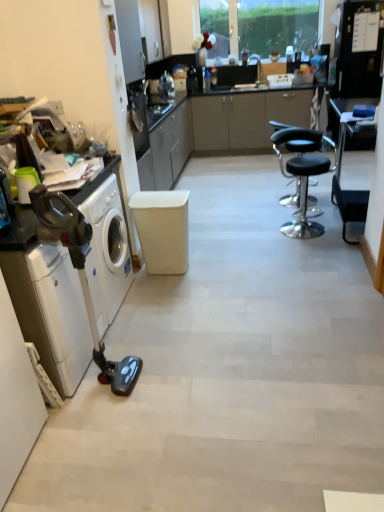
Find the location of `black leather stool at center`. black leather stool at center is located at coordinates (305, 197).

Locate an element on the screen. The height and width of the screenshot is (512, 384). white matte stool at center is located at coordinates (162, 229).

Find the location of `metallic gray vacuum cleaner at left`. metallic gray vacuum cleaner at left is located at coordinates click(74, 281).

What do you see at coordinates (350, 126) in the screenshot? Image resolution: width=384 pixels, height=512 pixels. I see `black plastic table at right` at bounding box center [350, 126].

Find the location of a particular element. This screenshot has width=384, height=512. black leather stool at center is located at coordinates click(305, 197).

Is metallic gray vacuum cleaner at left facing away from white glossy washing machine at left, which is counted as the first washing machine, starting from the back?

That's right, metallic gray vacuum cleaner at left is facing away from white glossy washing machine at left, which is counted as the first washing machine, starting from the back.

Considering the sizes of metallic gray vacuum cleaner at left and white glossy washing machine at left, which is counted as the first washing machine, starting from the back, in the image, is metallic gray vacuum cleaner at left wider or thinner than white glossy washing machine at left, which is counted as the first washing machine, starting from the back,?

Result: Clearly, metallic gray vacuum cleaner at left has more width compared to white glossy washing machine at left, which is counted as the first washing machine, starting from the back.

Considering the positions of objects metallic gray vacuum cleaner at left and white glossy washing machine at left, marked as the second washing machine in a front-to-back arrangement, in the image provided, who is more to the left, metallic gray vacuum cleaner at left or white glossy washing machine at left, marked as the second washing machine in a front-to-back arrangement,?

metallic gray vacuum cleaner at left is more to the left.

Between metallic gray vacuum cleaner at left and white glossy washing machine at left, marked as the second washing machine in a front-to-back arrangement, which one has smaller size?

Smaller between the two is white glossy washing machine at left, marked as the second washing machine in a front-to-back arrangement.

Is metallic gray vacuum cleaner at left positioned far away from black plastic table at right?

That's right, there is a large distance between metallic gray vacuum cleaner at left and black plastic table at right.

Locate an element on the screen. Image resolution: width=384 pixels, height=512 pixels. home appliance on the left of the black plastic table at right is located at coordinates (74, 281).

Which object is further away from the camera taking this photo, metallic gray vacuum cleaner at left or black plastic table at right?

black plastic table at right.

Considering the sizes of metallic gray vacuum cleaner at left and black plastic table at right in the image, is metallic gray vacuum cleaner at left taller or shorter than black plastic table at right?

Considering their sizes, metallic gray vacuum cleaner at left has less height than black plastic table at right.

Could you tell me if white plastic washing machine at left, the 2th washing machine in the back-to-front sequence, is facing black leather stool at center?

No.

Between point (74, 318) and point (300, 146), which one is positioned in front?

The point (74, 318) is more forward.

From the image's perspective, which one is positioned higher, white plastic washing machine at left, the first washing machine from the front, or black leather stool at center?

black leather stool at center appears higher in the image.

Is the position of white plastic washing machine at left, the 2th washing machine in the back-to-front sequence, more distant than that of black leather stool at center?

No, it is in front of black leather stool at center.

Is point (99, 307) closer or farther from the camera than point (74, 324)?

Point (99, 307) is farther from the camera than point (74, 324).

Is white glossy washing machine at left, which is counted as the first washing machine, starting from the back, facing towards metallic gray vacuum cleaner at left?

Yes, white glossy washing machine at left, which is counted as the first washing machine, starting from the back, is aimed at metallic gray vacuum cleaner at left.

From a real-world perspective, does white glossy washing machine at left, marked as the second washing machine in a front-to-back arrangement, stand above metallic gray vacuum cleaner at left?

No, from a real-world perspective, white glossy washing machine at left, marked as the second washing machine in a front-to-back arrangement, is not above metallic gray vacuum cleaner at left.

Which object is wider, white glossy washing machine at left, which is counted as the first washing machine, starting from the back, or metallic gray vacuum cleaner at left?

metallic gray vacuum cleaner at left is wider.

Considering the relative sizes of black leather stool at center and white matte stool at center in the image provided, is black leather stool at center taller than white matte stool at center?

Yes.

Does black leather stool at center have a lesser width compared to white matte stool at center?

No, black leather stool at center is not thinner than white matte stool at center.

Can we say black leather stool at center lies outside white matte stool at center?

Absolutely, black leather stool at center is external to white matte stool at center.

Considering the points (304, 174) and (176, 229), which point is in front, point (304, 174) or point (176, 229)?

The point (176, 229) is closer.

Where is `the 2nd washing machine to the left when counting from the black plastic table at right`? The image size is (384, 512). the 2nd washing machine to the left when counting from the black plastic table at right is located at coordinates pos(51,311).

Is black plastic table at right wider than white plastic washing machine at left, the 2th washing machine in the back-to-front sequence?

In fact, black plastic table at right might be narrower than white plastic washing machine at left, the 2th washing machine in the back-to-front sequence.

Considering the positions of objects black plastic table at right and white plastic washing machine at left, the first washing machine from the front, in the image provided, who is in front, black plastic table at right or white plastic washing machine at left, the first washing machine from the front,?

white plastic washing machine at left, the first washing machine from the front, is in front.

Is point (341, 120) positioned in front of point (20, 287)?

No, it is behind (20, 287).

From the image's perspective, is white plastic washing machine at left, the 2th washing machine in the back-to-front sequence, located above or below white matte stool at center?

Based on their image positions, white plastic washing machine at left, the 2th washing machine in the back-to-front sequence, is located beneath white matte stool at center.

From a real-world perspective, is white plastic washing machine at left, the first washing machine from the front, physically located above or below white matte stool at center?

From a real-world perspective, white plastic washing machine at left, the first washing machine from the front, is physically above white matte stool at center.

Based on the photo, which of these two, white plastic washing machine at left, the 2th washing machine in the back-to-front sequence, or white matte stool at center, is bigger?

With larger size is white plastic washing machine at left, the 2th washing machine in the back-to-front sequence.

Looking at this image, looking at their sizes, would you say white plastic washing machine at left, the first washing machine from the front, is wider or thinner than white matte stool at center?

white plastic washing machine at left, the first washing machine from the front, is wider than white matte stool at center.

The image size is (384, 512). Identify the location of home appliance on the left of white glossy washing machine at left, marked as the second washing machine in a front-to-back arrangement. (74, 281).

Where is `table behind the metallic gray vacuum cleaner at left`? table behind the metallic gray vacuum cleaner at left is located at coordinates (350, 126).

Based on their spatial positions, is black leather stool at center or white glossy washing machine at left, marked as the second washing machine in a front-to-back arrangement, closer to black plastic table at right?

Based on the image, black leather stool at center appears to be nearer to black plastic table at right.

Considering their positions, is black leather stool at center positioned further to black plastic table at right than white plastic washing machine at left, the 2th washing machine in the back-to-front sequence?

white plastic washing machine at left, the 2th washing machine in the back-to-front sequence, is positioned further to the anchor black plastic table at right.

Looking at the image, which one is located closer to black plastic table at right, metallic gray vacuum cleaner at left or white plastic washing machine at left, the first washing machine from the front?

The object closer to black plastic table at right is metallic gray vacuum cleaner at left.

Looking at the image, which one is located further to black leather stool at center, white glossy washing machine at left, which is counted as the first washing machine, starting from the back, or white matte stool at center?

white glossy washing machine at left, which is counted as the first washing machine, starting from the back.

Estimate the real-world distances between objects in this image. Which object is further from black leather stool at center, metallic gray vacuum cleaner at left or white matte stool at center?

Among the two, metallic gray vacuum cleaner at left is located further to black leather stool at center.

Considering their positions, is white plastic washing machine at left, the 2th washing machine in the back-to-front sequence, positioned further to black leather stool at center than metallic gray vacuum cleaner at left?

white plastic washing machine at left, the 2th washing machine in the back-to-front sequence, lies further to black leather stool at center than the other object.

Looking at the image, which one is located closer to black leather stool at center, white glossy washing machine at left, which is counted as the first washing machine, starting from the back, or black plastic table at right?

The object closer to black leather stool at center is black plastic table at right.

Estimate the real-world distances between objects in this image. Which object is further from black plastic table at right, metallic gray vacuum cleaner at left or black leather stool at center?

metallic gray vacuum cleaner at left.

Locate an element on the screen. Image resolution: width=384 pixels, height=512 pixels. washing machine situated between white plastic washing machine at left, the first washing machine from the front, and black plastic table at right from left to right is located at coordinates (108, 250).

Identify the location of stool between white plastic washing machine at left, the first washing machine from the front, and black leather stool at center from left to right. The image size is (384, 512). (162, 229).

Locate an element on the screen. This screenshot has height=512, width=384. washing machine between white plastic washing machine at left, the first washing machine from the front, and white matte stool at center in the front-back direction is located at coordinates (108, 250).

I want to click on chair situated between white glossy washing machine at left, which is counted as the first washing machine, starting from the back, and black plastic table at right from left to right, so click(x=305, y=197).